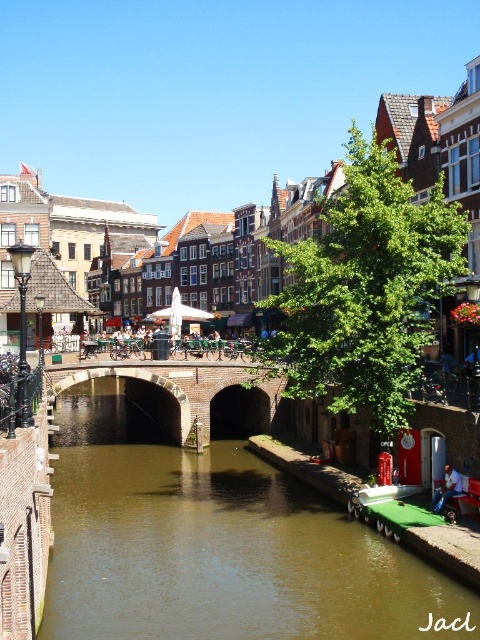
How distant is brown smooth water at center from brick stone bridge at center?

They are 12.03 meters apart.

Is brown smooth water at center wider than brick stone bridge at center?

Correct, the width of brown smooth water at center exceeds that of brick stone bridge at center.

Between point (137, 452) and point (235, 422), which one is positioned in front?

Positioned in front is point (137, 452).

What are the coordinates of `brown smooth water at center` in the screenshot? It's located at (216, 548).

Does point (133, 372) come in front of point (455, 493)?

No, it is behind (455, 493).

How distant is brick stone bridge at center from blue denim jeans at lower right?

They are 35.48 meters apart.

Who is more distant from viewer, (238, 419) or (451, 480)?

The point (238, 419) is more distant.

This screenshot has width=480, height=640. What are the coordinates of `brick stone bridge at center` in the screenshot? It's located at (189, 394).

Image resolution: width=480 pixels, height=640 pixels. Find the location of `brown smooth water at center`. brown smooth water at center is located at coordinates (216, 548).

Is point (158, 557) positioned behind point (453, 486)?

Yes, it is.

Where is `brown smooth water at center`? brown smooth water at center is located at coordinates [x=216, y=548].